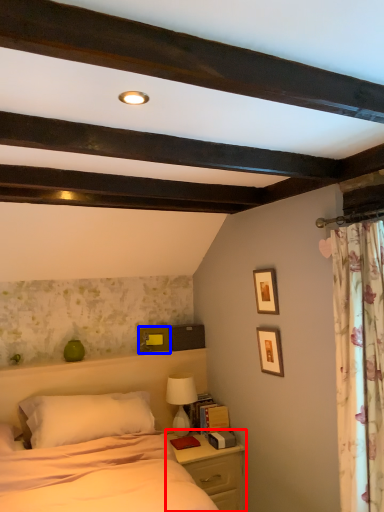
Question: Which object is closer to the camera taking this photo, nightstand (highlighted by a red box) or picture frame (highlighted by a blue box)?

Choices:
 (A) nightstand
 (B) picture frame

Answer: (A)